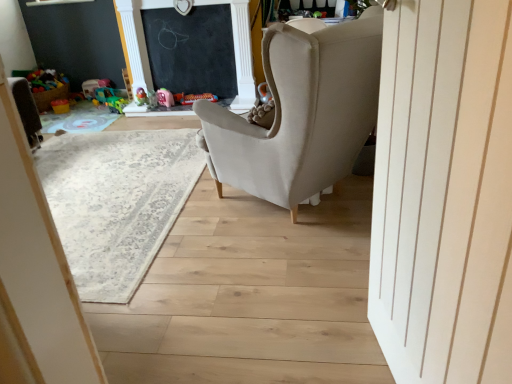
Locate an element on the screen. The height and width of the screenshot is (384, 512). vacant area on top of beige carpet at center (from a real-world perspective) is located at coordinates (87, 181).